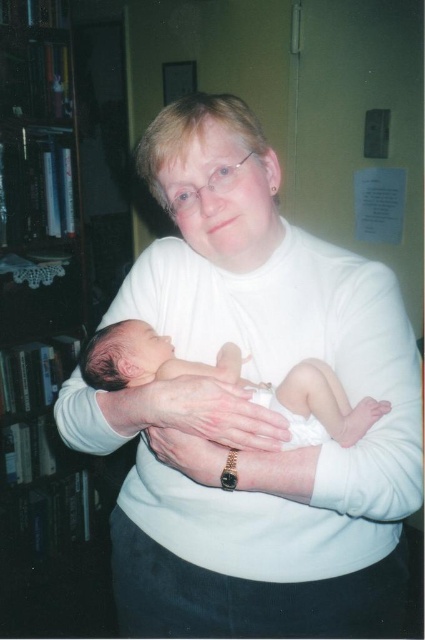
You are an interior designer assessing the room layout. You need to place a new 1.5 meter tall floor lamp in the room. Considering the white smooth sweater at center and the black wood bookshelf at left, which object should the lamp be placed closer to, and why?

The lamp should be placed closer to the black wood bookshelf at left because the white smooth sweater at center is shorter than the black wood bookshelf at left, so the taller bookshelf would provide a better backdrop or balance in the room layout.

You are a photographer taking a picture of the adult and the baby. You notice the white smooth sweater at center and the smooth white newborn at center. Which object is closer to the camera?

The smooth white newborn at center is closer to the camera because the white smooth sweater at center is positioned under it.

You are an interior designer planning to place a new painting between the black wood bookshelf at left and the smooth white newborn at center. Considering their widths, which object should the painting be closer to for proper balance?

The black wood bookshelf at left has a lesser width compared to the smooth white newborn at center, so the painting should be closer to the smooth white newborn at center to balance the visual weight.